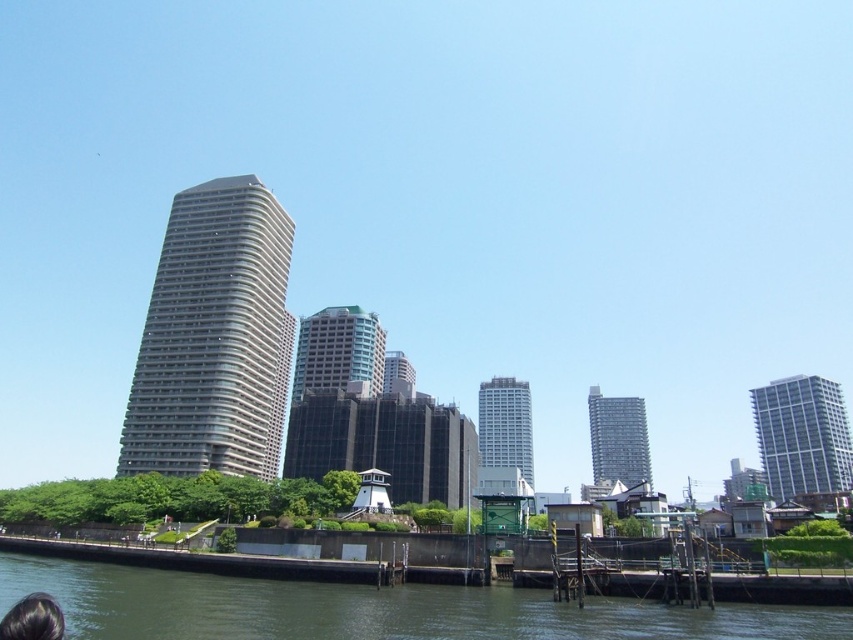
In the scene shown: Who is positioned more to the left, white glossy building at center or matte gray building at center?

From the viewer's perspective, matte gray building at center appears more on the left side.

Can you confirm if white glossy building at center is shorter than matte gray building at center?

No.

Does point (491, 410) come farther from viewer compared to point (386, 369)?

Yes.

This screenshot has height=640, width=853. Find the location of `white glossy building at center`. white glossy building at center is located at coordinates (505, 426).

Between white glossy building at center and dark brown hair at lower left, which one appears on the left side from the viewer's perspective?

From the viewer's perspective, dark brown hair at lower left appears more on the left side.

Does white glossy building at center lie in front of dark brown hair at lower left?

No.

Measure the distance between point (527, 461) and camera.

Point (527, 461) and camera are 195.99 meters apart from each other.

At what (x,y) coordinates should I click in order to perform the action: click on white glossy building at center. Please return your answer as a coordinate pair (x, y). The image size is (853, 640). Looking at the image, I should click on (505, 426).

Can you confirm if gray glassy building at center is positioned above white glossy building at right?

Yes, gray glassy building at center is above white glossy building at right.

Describe the element at coordinates (213, 337) in the screenshot. I see `gray glassy building at center` at that location.

Consider the image. Who is more distant from viewer, (267, 195) or (799, 465)?

Point (799, 465)

This screenshot has width=853, height=640. Identify the location of gray glassy building at center. (213, 337).